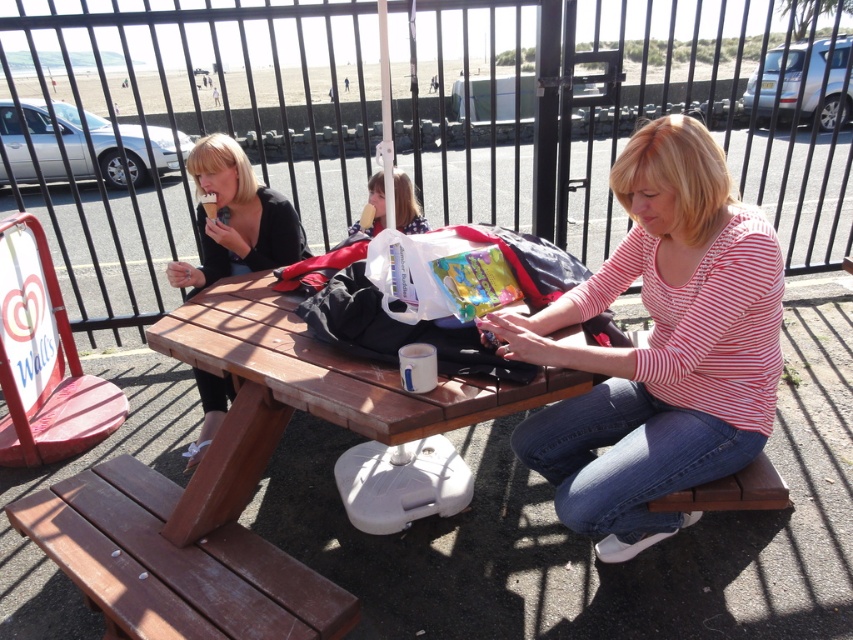
Question: Can you confirm if striped cotton shirt at center is thinner than brown wooden bench at lower center?

Choices:
 (A) yes
 (B) no

Answer: (B)

Question: Which is nearer to the matte black ice cream cone at left?

Choices:
 (A) brown wooden bench at lower center
 (B) matte plastic ice cream cone at center

Answer: (B)

Question: Does matte black ice cream cone at left come in front of brown wooden bench at lower center?

Choices:
 (A) no
 (B) yes

Answer: (A)

Question: Which point appears farthest from the camera in this image?

Choices:
 (A) (395, 218)
 (B) (206, 211)
 (C) (780, 296)
 (D) (10, 515)

Answer: (B)

Question: Is striped cotton shirt at center behind brown wooden bench at lower center?

Choices:
 (A) no
 (B) yes

Answer: (A)

Question: Based on their relative distances, which object is nearer to the matte plastic ice cream cone at center?

Choices:
 (A) matte black ice cream cone at left
 (B) brown wooden picnic table at center

Answer: (A)